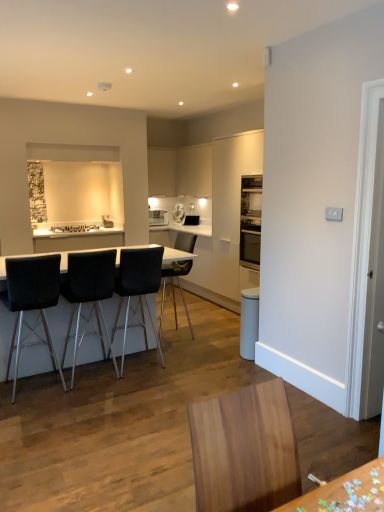
Find the location of a particular element. The height and width of the screenshot is (512, 384). vacant space to the right of black fabric chair at left, the fourth chair in the right-to-left sequence is located at coordinates (97, 396).